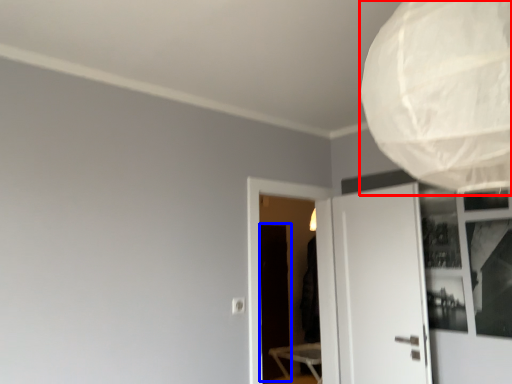
Question: Which point is closer to the camera, lamp (highlighted by a red box) or screen door (highlighted by a blue box)?

Choices:
 (A) lamp
 (B) screen door

Answer: (A)